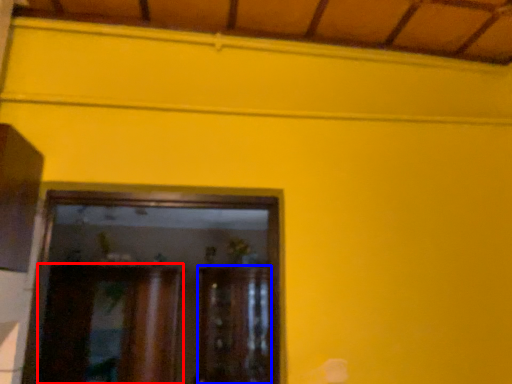
Question: Which object appears closest to the camera in this image, cabinetry (highlighted by a red box) or cabinetry (highlighted by a blue box)?

Choices:
 (A) cabinetry
 (B) cabinetry

Answer: (A)